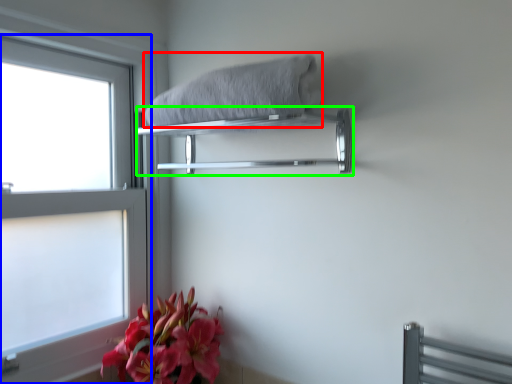
Question: Which object is the closest to the bath towel (highlighted by a red box)? Choose among these: window (highlighted by a blue box) or balustrade (highlighted by a green box).

Choices:
 (A) window
 (B) balustrade

Answer: (B)